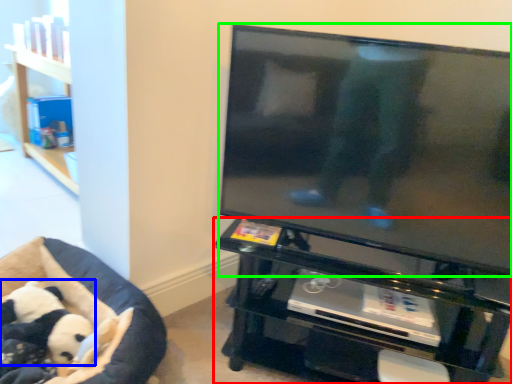
Question: Considering the real-world distances, which object is closest to furniture (highlighted by a red box)? panda (highlighted by a blue box) or television (highlighted by a green box).

Choices:
 (A) panda
 (B) television

Answer: (B)